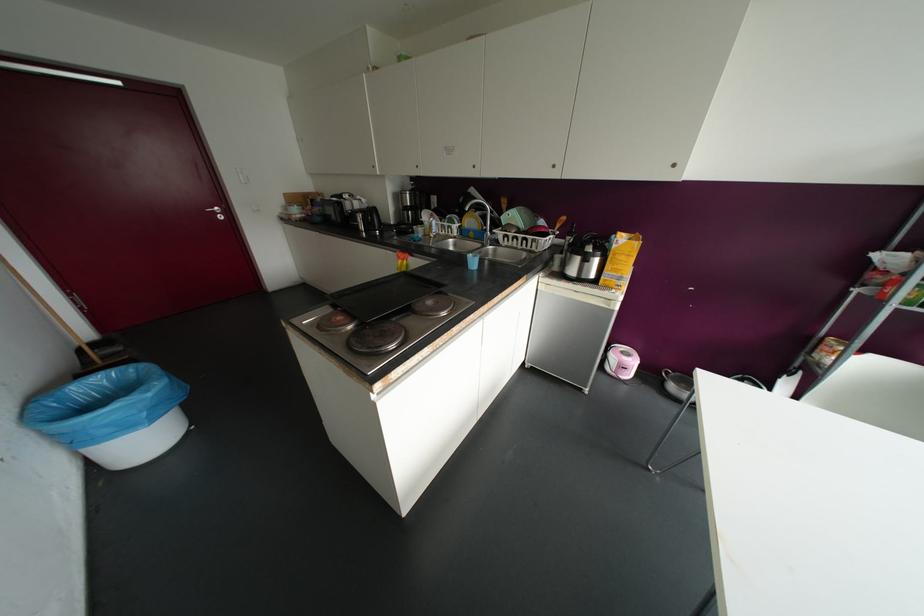
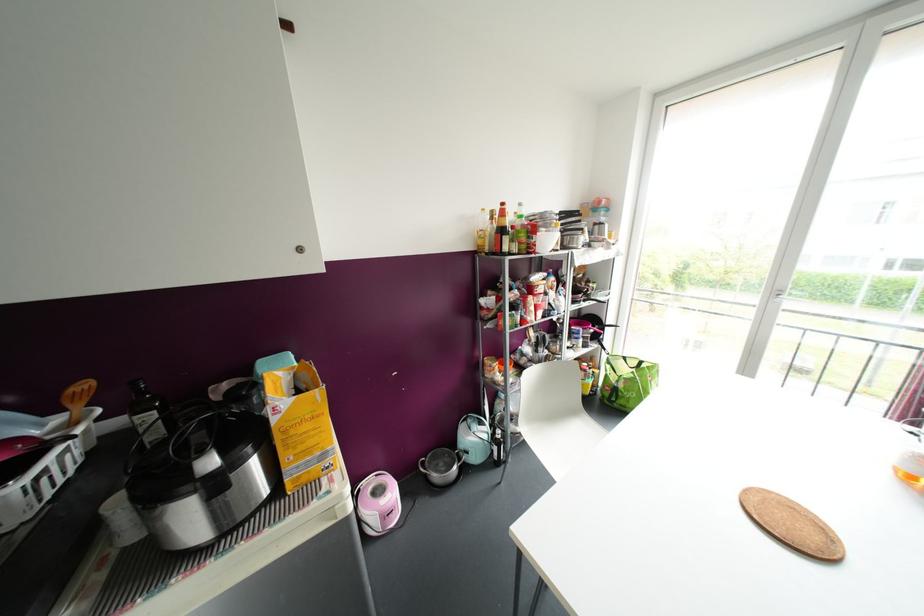
Locate, in the second image, the point that corresponds to (x=569, y=238) in the first image.

(150, 416)